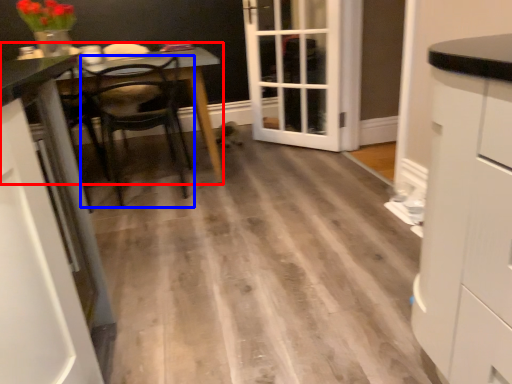
Question: Which object is closer to the camera taking this photo, table (highlighted by a red box) or chair (highlighted by a blue box)?

Choices:
 (A) table
 (B) chair

Answer: (B)